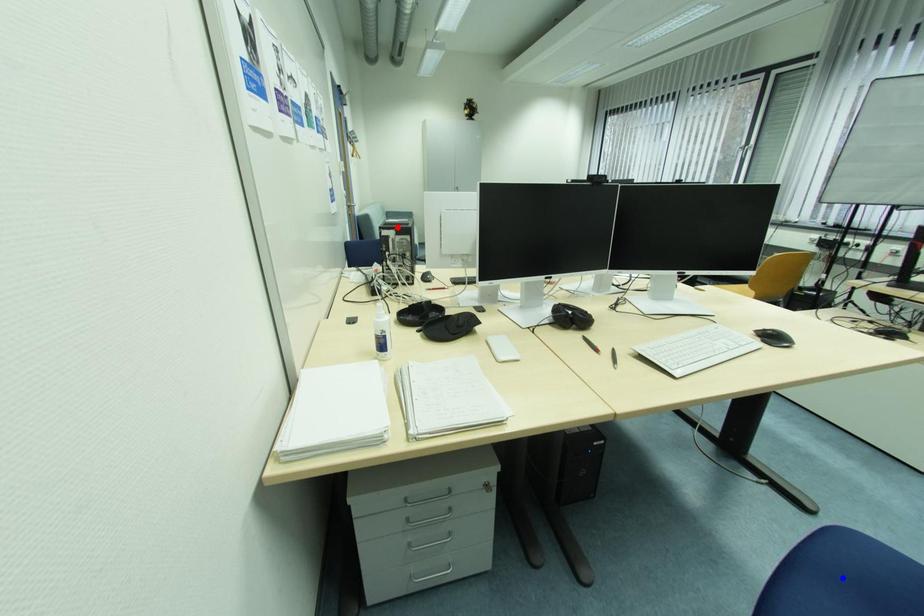
Question: Two points are marked on the image. Which point is closer to the camera?

Choices:
 (A) Blue point is closer.
 (B) Red point is closer.

Answer: (A)